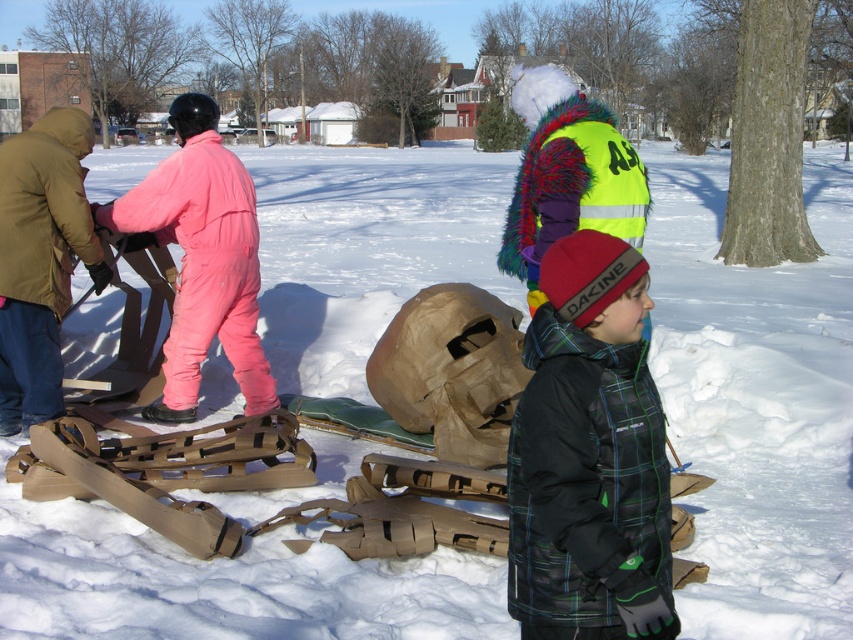
You are a photographer trying to capture a candid shot of the black plaid jacket at center and the brown leather gloves at left. Your camera has a maximum focus range of 5 meters. Can you take a photo that includes both subjects without moving your position?

The distance between the black plaid jacket at center and the brown leather gloves at left is 4.54 meters, which is within the camera maximum focus range of 5 meters. Therefore, you can take a photo that includes both subjects without moving your position.

You are a photographer trying to capture a group photo of the black plaid jacket at center and the pink matte snowsuit at left. The camera you are using has a maximum focus range of 12 feet. Can you take a photo of both individuals without moving either of them?

The black plaid jacket at center and pink matte snowsuit at left are 14.00 feet apart from each other, which exceeds the camera maximum focus range of 12 feet. Therefore, you cannot take a photo of both individuals without moving them closer together.